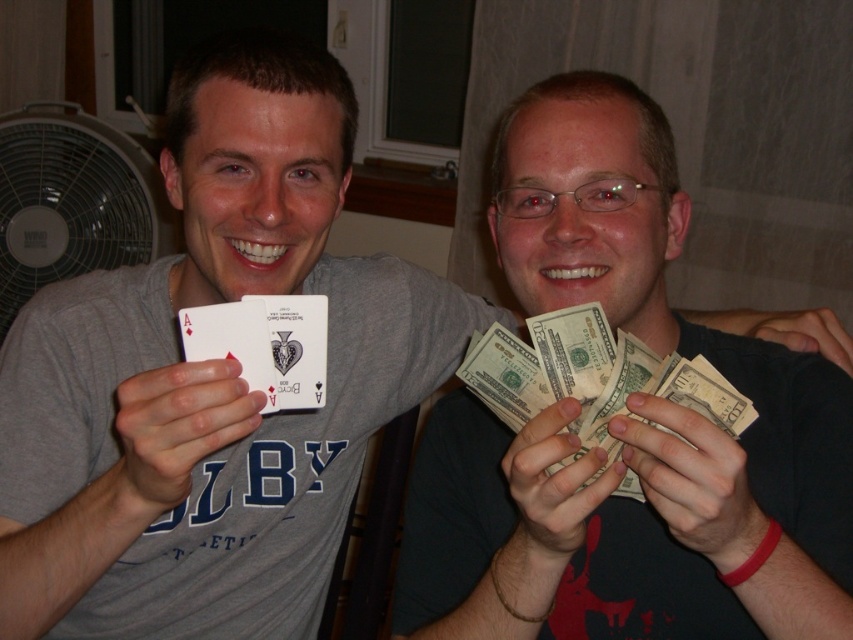
Looking at this image, how distant is white plastic fan at left from smooth paper money at center?

white plastic fan at left is 1.65 meters from smooth paper money at center.

Is white plastic fan at left further to the viewer compared to smooth paper money at center?

Yes, it is.

Is point (102, 268) less distant than point (546, 490)?

No, it is not.

What are the coordinates of `white plastic fan at left` in the screenshot? It's located at (73, 202).

Is point (601, 467) farther from camera compared to point (659, 451)?

Yes, point (601, 467) is farther from viewer.

Does green paper money at right appear on the left side of smooth paper money at lower right?

Yes, green paper money at right is to the left of smooth paper money at lower right.

At what (x,y) coordinates should I click in order to perform the action: click on green paper money at right. Please return your answer as a coordinate pair (x, y). This screenshot has width=853, height=640. Looking at the image, I should click on (590, 378).

You are a GUI agent. You are given a task and a screenshot of the screen. Output one action in this format:
    pyautogui.click(x=<x>, y=<y>)
    Task: Click on the green paper money at right
    The image size is (853, 640).
    Given the screenshot: What is the action you would take?
    pyautogui.click(x=590, y=378)

Measure the distance from white matte card at center to black matte hand at center.

white matte card at center and black matte hand at center are 24.94 inches apart.

Between point (149, 509) and point (843, 348), which one is positioned in front?

Point (149, 509) is more forward.

Locate an element on the screen. The height and width of the screenshot is (640, 853). white matte card at center is located at coordinates (173, 432).